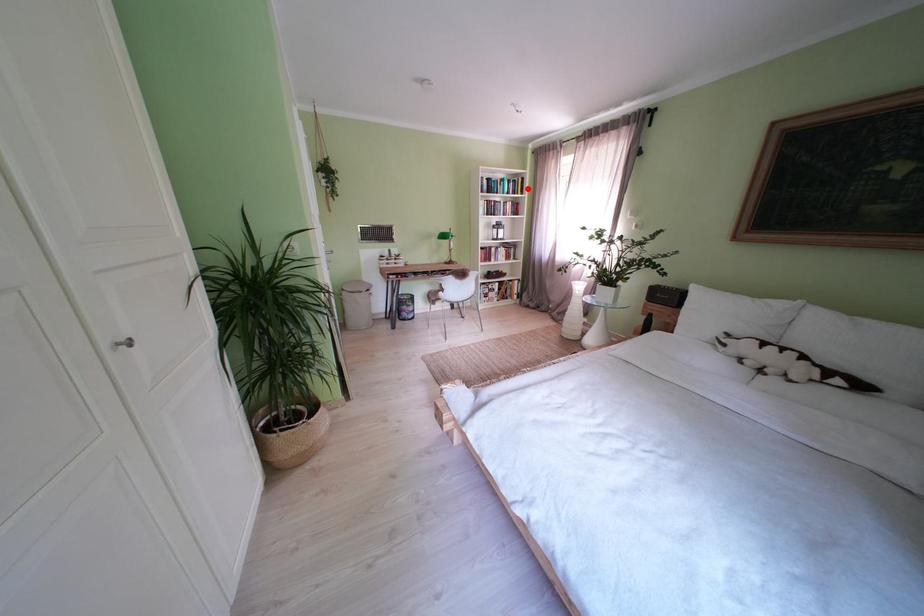
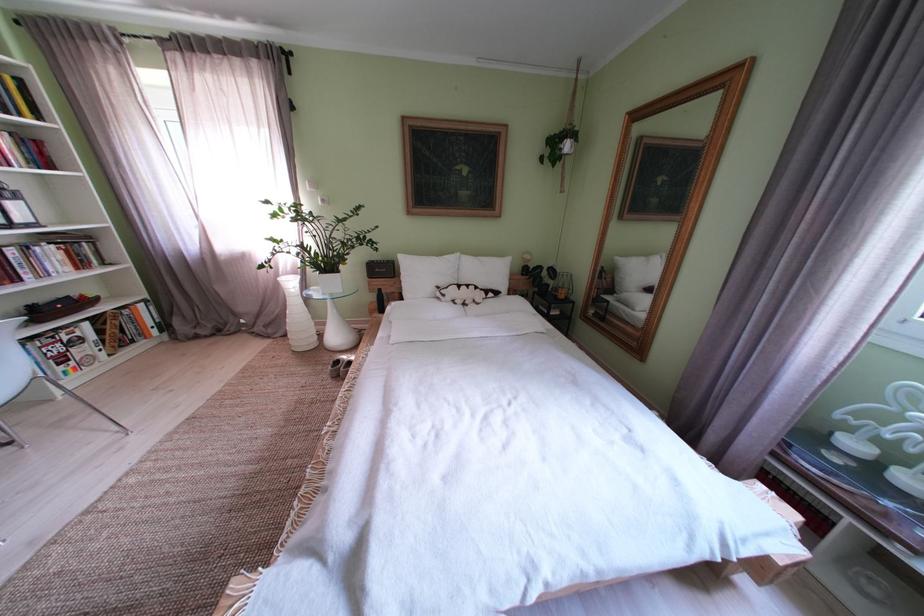
Locate, in the second image, the point that corresponds to the highlighted location in the first image.

(9, 92)